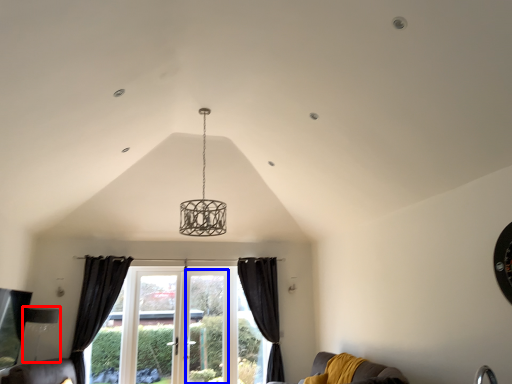
Question: Which object is further to the camera taking this photo, lamp (highlighted by a red box) or screen door (highlighted by a blue box)?

Choices:
 (A) lamp
 (B) screen door

Answer: (B)